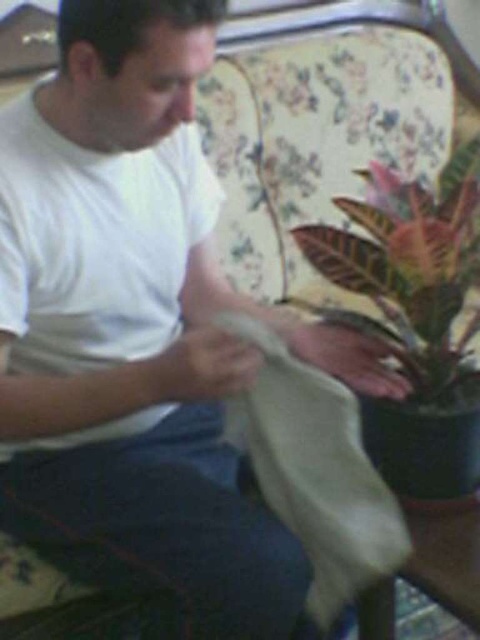
Is white matte t-shirt at left further to camera compared to white matte cloth at lower center?

No, it is in front of white matte cloth at lower center.

Does white matte t-shirt at left have a lesser height compared to white matte cloth at lower center?

Incorrect, white matte t-shirt at left's height does not fall short of white matte cloth at lower center's.

The height and width of the screenshot is (640, 480). Find the location of `white matte t-shirt at left`. white matte t-shirt at left is located at coordinates (95, 243).

In order to click on white matte t-shirt at left in this screenshot , I will do `click(95, 243)`.

Image resolution: width=480 pixels, height=640 pixels. What do you see at coordinates (315, 472) in the screenshot? I see `white matte cloth at lower center` at bounding box center [315, 472].

Looking at this image, can you confirm if white matte cloth at lower center is positioned above leathery green leaf at right?

No.

Who is more forward, (307, 600) or (396, 236)?

Point (396, 236)

Where is `white matte cloth at lower center`? white matte cloth at lower center is located at coordinates (315, 472).

Is point (166, 236) farther from viewer compared to point (397, 316)?

No, it is in front of (397, 316).

Is white matte t-shirt at left positioned behind leathery green leaf at right?

No, white matte t-shirt at left is in front of leathery green leaf at right.

Does point (73, 177) lie in front of point (463, 280)?

That is True.

You are a GUI agent. You are given a task and a screenshot of the screen. Output one action in this format:
    pyautogui.click(x=<x>, y=<y>)
    Task: Click on the white matte t-shirt at left
    The image size is (480, 640).
    Given the screenshot: What is the action you would take?
    pyautogui.click(x=95, y=243)